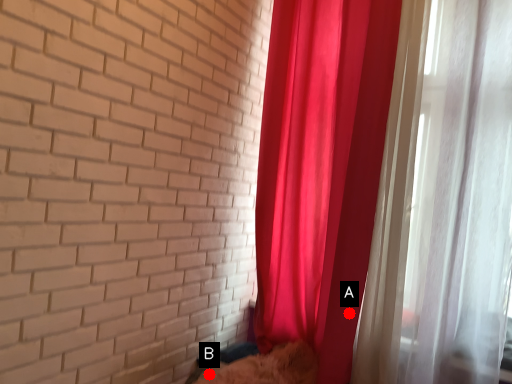
Question: Two points are circled on the image, labeled by A and B beside each circle. Which point appears closest to the camera in this image?

Choices:
 (A) A is closer
 (B) B is closer

Answer: (B)